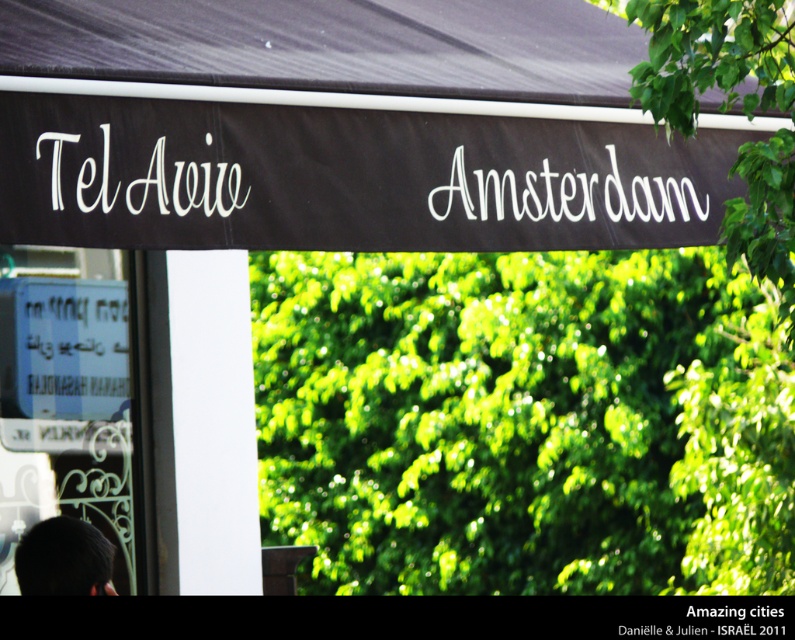
Question: Is white painted text at upper center wider than black hair at lower left?

Choices:
 (A) yes
 (B) no

Answer: (A)

Question: Considering the relative positions of white painted text at upper center and white fabric tel aviv at upper left in the image provided, where is white painted text at upper center located with respect to white fabric tel aviv at upper left?

Choices:
 (A) above
 (B) below

Answer: (B)

Question: Which is nearer to the white fabric tel aviv at upper left?

Choices:
 (A) black hair at lower left
 (B) white painted text at upper center
 (C) black fabric canopy at upper center

Answer: (C)

Question: Which point is farther to the camera?

Choices:
 (A) white fabric tel aviv at upper left
 (B) black fabric canopy at upper center

Answer: (A)

Question: Among these points, which one is farthest from the camera?

Choices:
 (A) (574, 220)
 (B) (64, 525)

Answer: (B)

Question: Does white fabric tel aviv at upper left have a larger size compared to black hair at lower left?

Choices:
 (A) yes
 (B) no

Answer: (B)